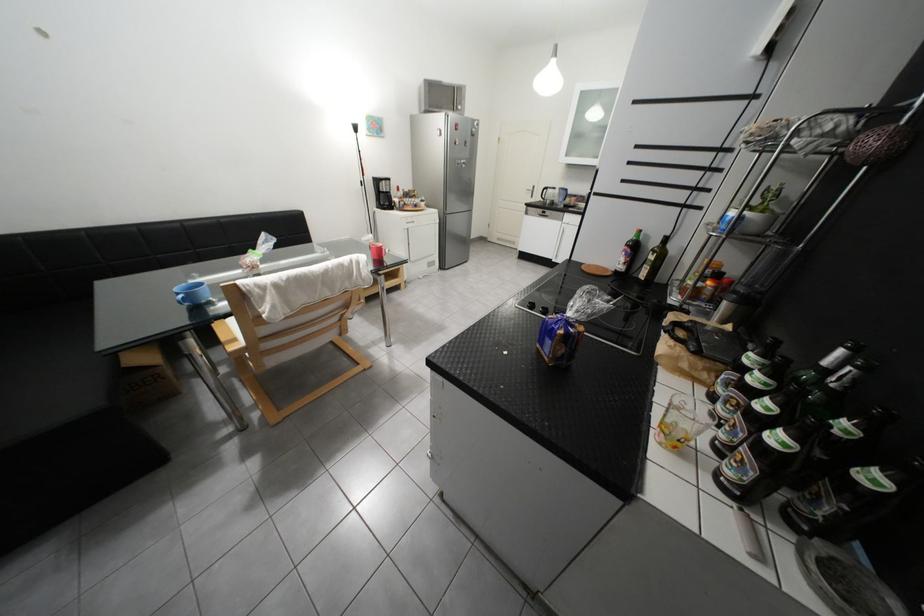
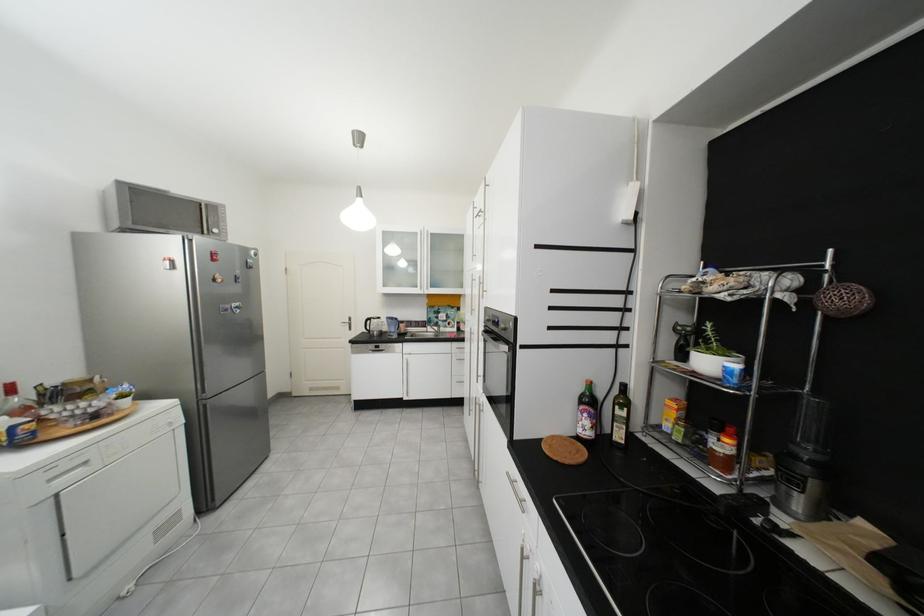
Locate, in the second image, the point that corresponds to the point at 557,190 in the first image.

(381, 321)